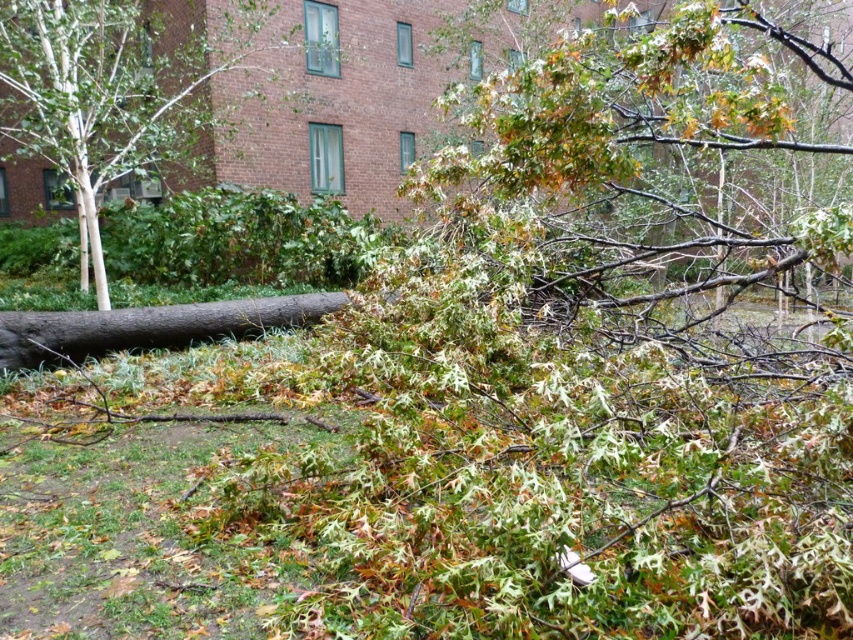
Question: Is green leafy branches at upper right in front of smooth white bark at left?

Choices:
 (A) no
 (B) yes

Answer: (B)

Question: Which object appears farthest from the camera in this image?

Choices:
 (A) smooth white bark at left
 (B) green leafy branches at upper right

Answer: (A)

Question: Which object is closer to the camera taking this photo?

Choices:
 (A) green leafy branches at upper right
 (B) smooth white bark at left

Answer: (A)

Question: Can you confirm if green leafy branches at upper right is smaller than smooth white bark at left?

Choices:
 (A) no
 (B) yes

Answer: (A)

Question: Can you confirm if green leafy branches at upper right is bigger than smooth white bark at left?

Choices:
 (A) yes
 (B) no

Answer: (A)